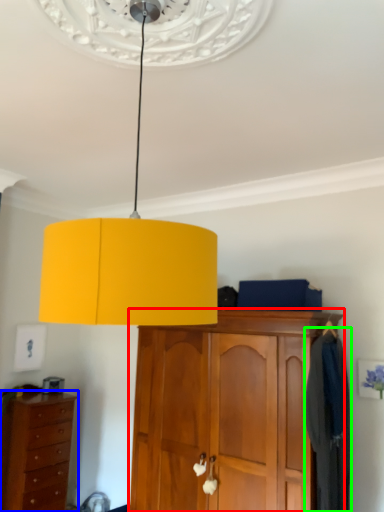
Question: Which object is the farthest from cabinetry (highlighted by a red box)? Choose among these: chest of drawers (highlighted by a blue box) or clothing (highlighted by a green box).

Choices:
 (A) chest of drawers
 (B) clothing

Answer: (A)